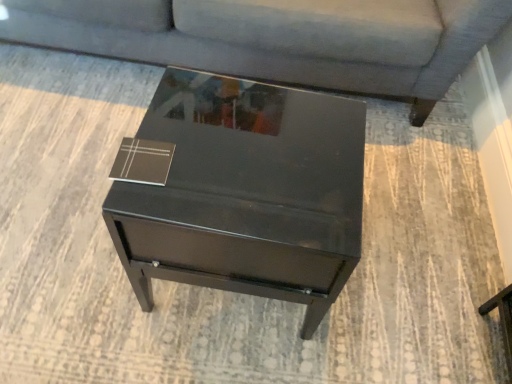
Image resolution: width=512 pixels, height=384 pixels. I want to click on spots to the right of brown leather book at upper left, so click(x=225, y=167).